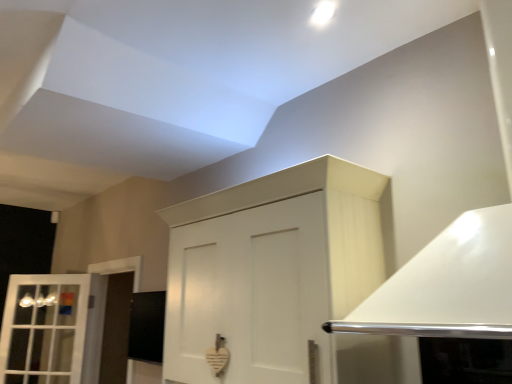
Question: Is white glass window at left next to white matte cabinet at center and touching it?

Choices:
 (A) yes
 (B) no

Answer: (B)

Question: Is white glass window at left wider than white matte cabinet at center?

Choices:
 (A) yes
 (B) no

Answer: (B)

Question: Is white glass window at left further to the viewer compared to white matte cabinet at center?

Choices:
 (A) no
 (B) yes

Answer: (B)

Question: From the image's perspective, is white glass window at left beneath white matte cabinet at center?

Choices:
 (A) no
 (B) yes

Answer: (B)

Question: Is white glass window at left completely or partially outside of white matte cabinet at center?

Choices:
 (A) yes
 (B) no

Answer: (A)

Question: Would you say white matte cabinet at center is part of white glass window at left's contents?

Choices:
 (A) yes
 (B) no

Answer: (B)

Question: Is the position of white matte cabinet at center more distant than that of white glass window at left?

Choices:
 (A) no
 (B) yes

Answer: (A)

Question: Is the surface of white matte cabinet at center in direct contact with white glass window at left?

Choices:
 (A) yes
 (B) no

Answer: (B)

Question: Considering the relative positions of white matte cabinet at center and white glass window at left in the image provided, is white matte cabinet at center to the right of white glass window at left from the viewer's perspective?

Choices:
 (A) no
 (B) yes

Answer: (B)

Question: Is white matte cabinet at center positioned with its back to white glass window at left?

Choices:
 (A) yes
 (B) no

Answer: (B)

Question: From the image's perspective, is white matte cabinet at center beneath white glass window at left?

Choices:
 (A) no
 (B) yes

Answer: (A)

Question: From a real-world perspective, is white matte cabinet at center positioned under white glass window at left based on gravity?

Choices:
 (A) yes
 (B) no

Answer: (B)

Question: Is white matte cabinet at center situated inside white glass window at left or outside?

Choices:
 (A) outside
 (B) inside

Answer: (A)